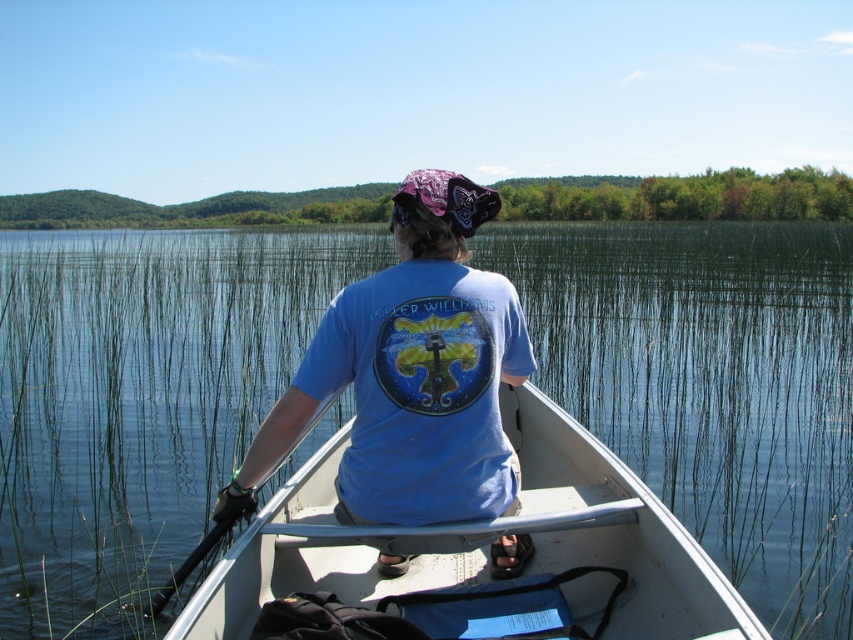
Question: Based on their relative distances, which object is farther from the blue cotton shirt at center?

Choices:
 (A) clear water at center
 (B) white plastic boat at center

Answer: (A)

Question: Can you confirm if clear water at center is positioned to the left of blue cotton shirt at center?

Choices:
 (A) yes
 (B) no

Answer: (A)

Question: Can you confirm if blue cotton shirt at center is smaller than white plastic boat at center?

Choices:
 (A) yes
 (B) no

Answer: (A)

Question: Which is farther from the white plastic boat at center?

Choices:
 (A) blue cotton shirt at center
 (B) clear water at center

Answer: (B)

Question: Is clear water at center smaller than white plastic boat at center?

Choices:
 (A) yes
 (B) no

Answer: (B)

Question: Which of these objects is positioned farthest from the blue cotton shirt at center?

Choices:
 (A) white plastic boat at center
 (B) clear water at center

Answer: (B)